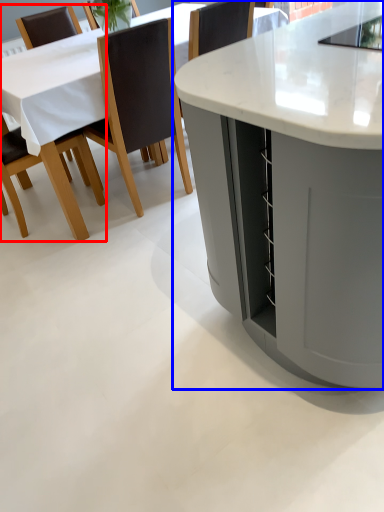
Question: Which object appears farthest to the camera in this image, chair (highlighted by a red box) or table (highlighted by a blue box)?

Choices:
 (A) chair
 (B) table

Answer: (A)